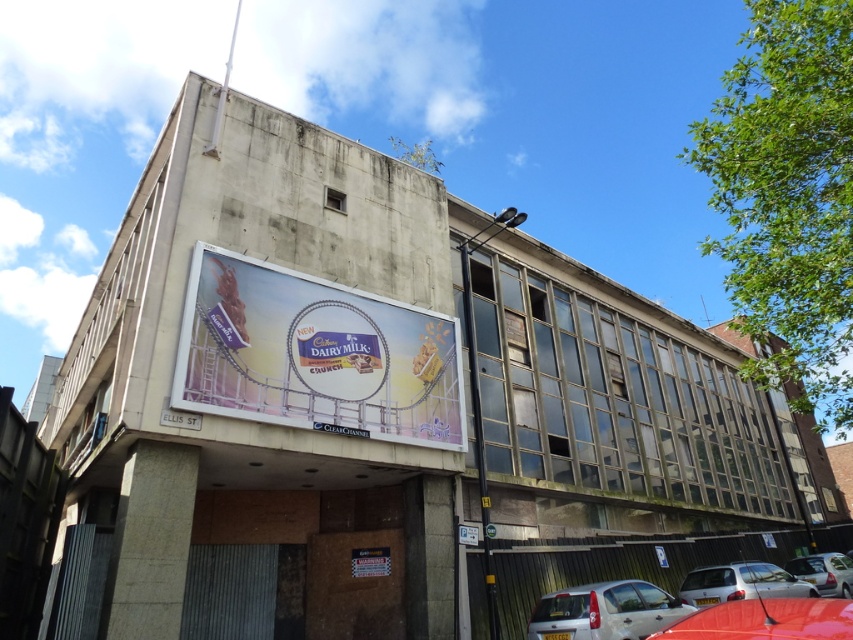
Is white glossy billboard at center bigger than silver metallic car at lower right?

Correct, white glossy billboard at center is larger in size than silver metallic car at lower right.

Can you confirm if white glossy billboard at center is positioned above silver metallic car at lower right?

Indeed, white glossy billboard at center is positioned over silver metallic car at lower right.

The width and height of the screenshot is (853, 640). Identify the location of white glossy billboard at center. (315, 355).

Which is more to the left, white glossy billboard at center or silver metallic hatchback at lower center?

white glossy billboard at center

Is white glossy billboard at center to the left of silver metallic hatchback at lower center from the viewer's perspective?

Indeed, white glossy billboard at center is positioned on the left side of silver metallic hatchback at lower center.

Is point (242, 342) more distant than point (532, 630)?

That is True.

Where is `white glossy billboard at center`? white glossy billboard at center is located at coordinates (315, 355).

Which is behind, point (563, 611) or point (833, 579)?

The point (833, 579) is behind.

Between silver metallic hatchback at lower center and white glossy car at lower right, which one appears on the left side from the viewer's perspective?

From the viewer's perspective, silver metallic hatchback at lower center appears more on the left side.

Is point (618, 614) closer to viewer compared to point (809, 561)?

Yes, it is.

Identify the location of silver metallic hatchback at lower center. This screenshot has height=640, width=853. (604, 611).